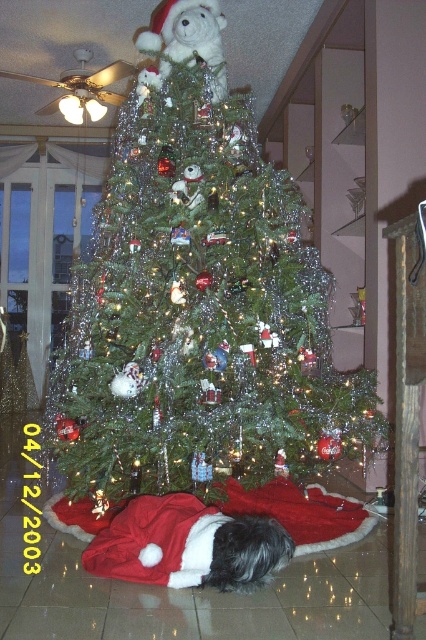
You are standing in front of the Christmas tree and want to place a new ornament at the point marked as point (x=117, y=556). Considering the tree is 6 feet tall, will the ornament be visible from your current position?

The point (x=117, y=556) is 5.67 feet away from the viewer. Since the tree is 6 feet tall, the ornament placed at this point will be just below the top of the tree and should be visible from your current position.

You are standing in front of the Christmas tree and see the point marked at coordinates (187, 545). What object is located at that point?

The point at coordinates (187, 545) marks the location of the white soft dog at lower center.